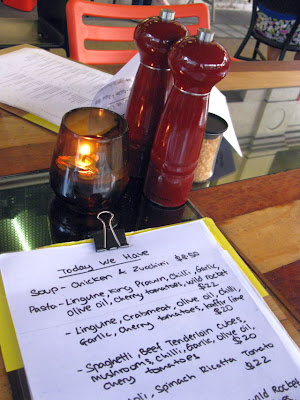
Image resolution: width=300 pixels, height=400 pixels. Identify the location of black metal chair. (267, 42).